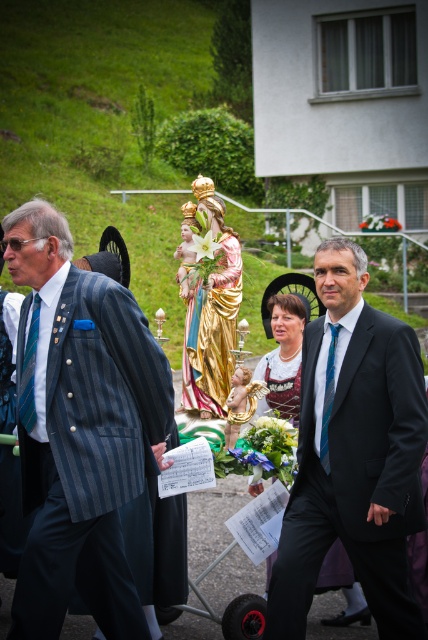
You are attending a religious ceremony and need to hand a document to the person with the blue striped tie at left. The gold metallic statue at center is blocking your path. Can you walk around the statue to reach them?

The gold metallic statue at center is closer to you than the blue striped tie at left, so you would need to go around the statue to reach the person with the blue striped tie at left.

You are an event planner organizing a ceremony. You need to place the gold metallic statue at center and the blue striped tie at left in a way that respects their sizes. Which object should be placed higher to maintain visual balance?

The blue striped tie at left should be placed higher since it is larger than the gold metallic statue at center, allowing for better visual balance between the two objects.

You are an event planner organizing the seating for the ceremony. You need to place a podium for the gold metallic statue at center and a microphone stand for the blue silk tie at center. According to the image, which object should be placed to the left of the other?

The gold metallic statue at center should be placed to the left of the blue silk tie at center because the gold metallic statue at center is positioned on the left side of blue silk tie at center in the image.